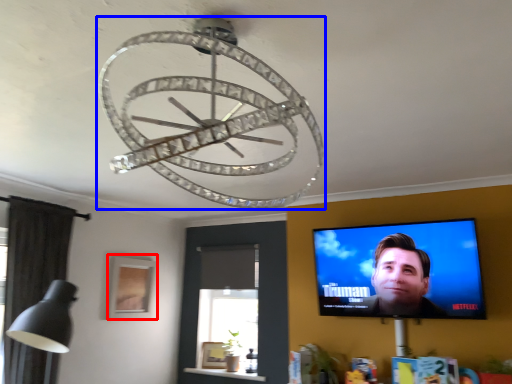
Question: Which object is closer to the camera taking this photo, picture frame (highlighted by a red box) or lamp (highlighted by a blue box)?

Choices:
 (A) picture frame
 (B) lamp

Answer: (B)